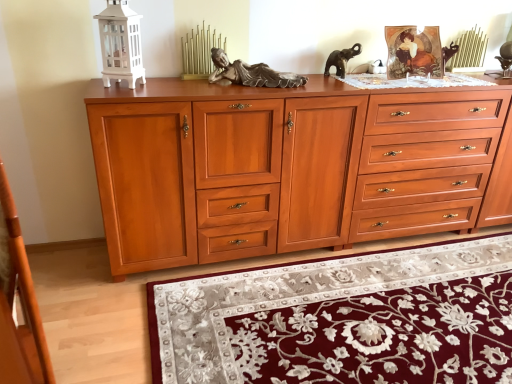
Question: Relative to cherry wood chest of drawers at center, is wooden drawer at center, which ranks as the first drawer in left-to-right order, in front or behind?

Choices:
 (A) behind
 (B) front

Answer: (A)

Question: From the image's perspective, is wooden drawer at center, which ranks as the first drawer in left-to-right order, located above or below cherry wood chest of drawers at center?

Choices:
 (A) below
 (B) above

Answer: (B)

Question: Which is nearer to the cherry wood chest of drawers at center?

Choices:
 (A) wooden drawer at center, which is the 2th drawer from right to left
 (B) velvet burgundy rug at lower center
 (C) cherry wood drawers at right, which is the 1th drawer from right to left

Answer: (A)

Question: Estimate the real-world distances between objects in this image. Which object is farther from the velvet burgundy rug at lower center?

Choices:
 (A) cherry wood chest of drawers at center
 (B) wooden drawer at center, which ranks as the first drawer in left-to-right order
 (C) cherry wood drawers at right, acting as the 2th drawer starting from the left

Answer: (B)